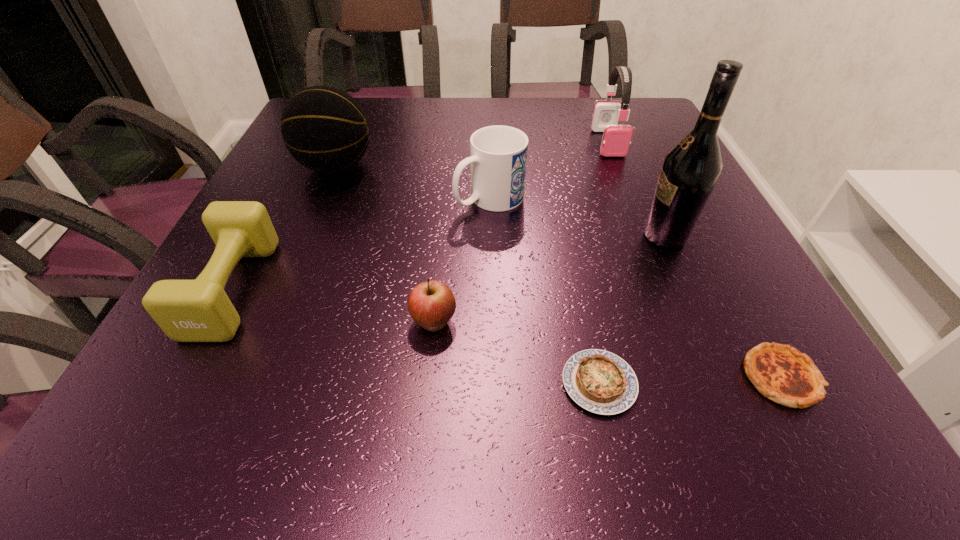
Locate an element on the screen. Image resolution: width=960 pixels, height=540 pixels. basketball that is at the left edge is located at coordinates (324, 128).

The image size is (960, 540). In order to click on dumbbell positioned at the left edge in this screenshot , I will do `click(199, 310)`.

Where is `wine bottle that is at the right edge`? The height and width of the screenshot is (540, 960). wine bottle that is at the right edge is located at coordinates (690, 170).

In order to click on earphone situated at the right edge in this screenshot , I will do `click(616, 138)`.

The image size is (960, 540). Find the location of `quiche located in the right edge section of the desktop`. quiche located in the right edge section of the desktop is located at coordinates (781, 373).

This screenshot has width=960, height=540. Find the location of `object at the far right corner`. object at the far right corner is located at coordinates (616, 138).

Locate an element on the screen. The image size is (960, 540). object located in the near right corner section of the desktop is located at coordinates 781,373.

Where is `free space at the far edge of the desktop`? free space at the far edge of the desktop is located at coordinates (480, 109).

Locate an element on the screen. This screenshot has height=540, width=960. vacant space at the near edge of the desktop is located at coordinates (332, 428).

The width and height of the screenshot is (960, 540). Find the location of `vacant position at the left edge of the desktop`. vacant position at the left edge of the desktop is located at coordinates (290, 217).